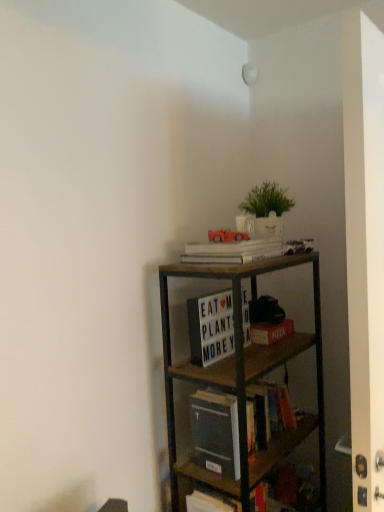
Question: From the image's perspective, is matte red car at upper center above white matte letter board at center, which appears as the 2th book when ordered from the bottom?

Choices:
 (A) no
 (B) yes

Answer: (B)

Question: From the image's perspective, would you say matte red car at upper center is shown under white matte letter board at center, which appears as the 2th book when ordered from the bottom?

Choices:
 (A) yes
 (B) no

Answer: (B)

Question: Is matte red car at upper center smaller than white matte letter board at center, which appears as the 2th book when ordered from the bottom?

Choices:
 (A) yes
 (B) no

Answer: (A)

Question: Is matte red car at upper center touching white matte letter board at center, positioned as the second book in top-to-bottom order?

Choices:
 (A) yes
 (B) no

Answer: (B)

Question: Could you tell me if matte red car at upper center is turned towards white matte letter board at center, which appears as the 2th book when ordered from the bottom?

Choices:
 (A) yes
 (B) no

Answer: (B)

Question: From the image's perspective, is white matte letter board at center, positioned as the second book in top-to-bottom order, above or below hardcover book at center, acting as the first book starting from the bottom?

Choices:
 (A) below
 (B) above

Answer: (B)

Question: In terms of width, does white matte letter board at center, positioned as the second book in top-to-bottom order, look wider or thinner when compared to hardcover book at center, placed as the 3th book when sorted from top to bottom?

Choices:
 (A) thin
 (B) wide

Answer: (A)

Question: Visually, is white matte letter board at center, positioned as the second book in top-to-bottom order, positioned to the left or to the right of hardcover book at center, placed as the 3th book when sorted from top to bottom?

Choices:
 (A) right
 (B) left

Answer: (B)

Question: Is point (x=223, y=293) positioned closer to the camera than point (x=258, y=445)?

Choices:
 (A) closer
 (B) farther

Answer: (B)

Question: In terms of height, does red matte paper at center look taller or shorter compared to wooden shelf at center?

Choices:
 (A) tall
 (B) short

Answer: (B)

Question: In terms of size, does red matte paper at center appear bigger or smaller than wooden shelf at center?

Choices:
 (A) big
 (B) small

Answer: (B)

Question: Considering their positions, is red matte paper at center located in front of or behind wooden shelf at center?

Choices:
 (A) behind
 (B) front

Answer: (A)

Question: Is point (254, 330) positioned closer to the camera than point (276, 444)?

Choices:
 (A) farther
 (B) closer

Answer: (A)

Question: Based on their sizes in the image, would you say white matte book at upper center, marked as the 1th book in a top-to-bottom arrangement, is bigger or smaller than green matte plant at upper center?

Choices:
 (A) big
 (B) small

Answer: (B)

Question: Does point (188, 251) appear closer or farther from the camera than point (249, 202)?

Choices:
 (A) closer
 (B) farther

Answer: (A)